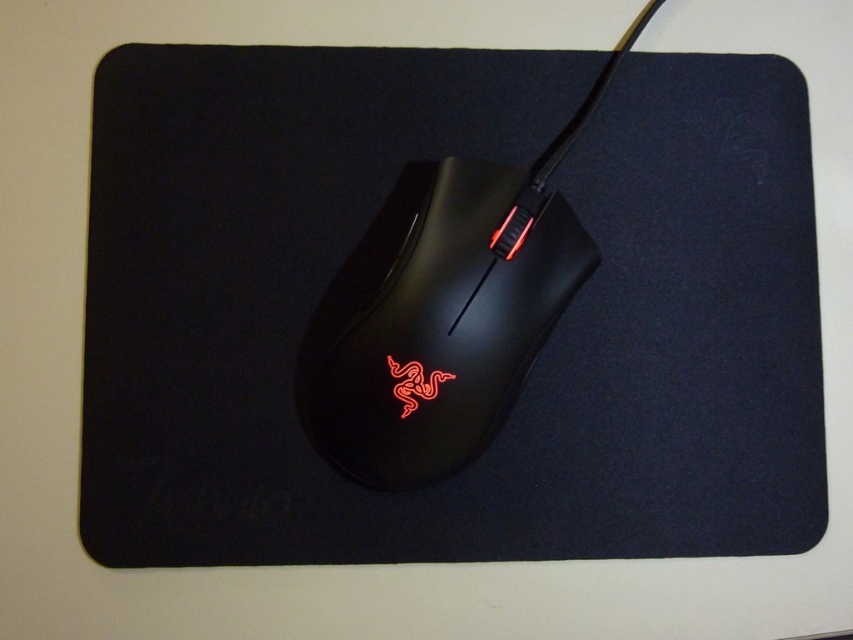
Is black matte mousepad at center below matte black mouse at center?

Incorrect, black matte mousepad at center is not positioned below matte black mouse at center.

The width and height of the screenshot is (853, 640). Find the location of `black matte mousepad at center`. black matte mousepad at center is located at coordinates (387, 268).

What are the coordinates of `black matte mousepad at center` in the screenshot? It's located at (387, 268).